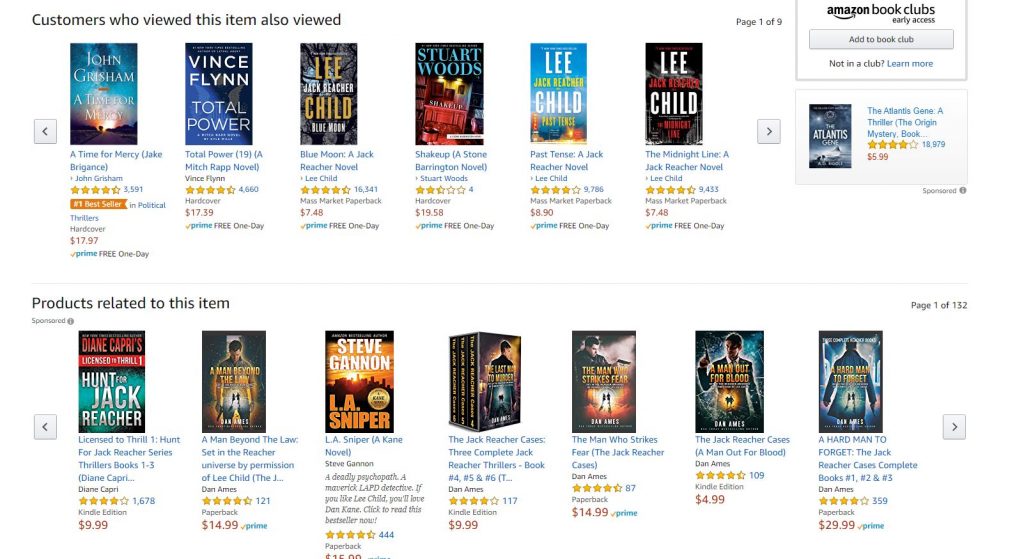
The image size is (1024, 559). I want to click on books in bottom row, so click(115, 389), click(251, 388), click(352, 364), click(481, 367), click(616, 362), click(726, 372), click(850, 402).